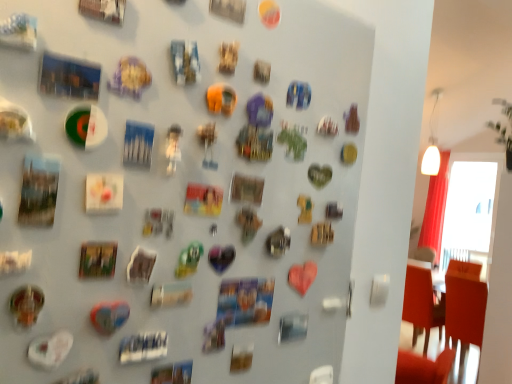
Identify the location of wooden framed picture at center-left, the third art positioned from the top. The width and height of the screenshot is (512, 384). pyautogui.click(x=97, y=259).

Locate an element on the screen. metallic gold coin at lower left, which appears as the second art when ordered from the bottom is located at coordinates (26, 305).

Where is `metallic silver magnet at center-left, which appears as the fourth art when viewed from the top`? The height and width of the screenshot is (384, 512). metallic silver magnet at center-left, which appears as the fourth art when viewed from the top is located at coordinates (141, 265).

Describe the element at coordinates (185, 61) in the screenshot. This screenshot has height=384, width=512. I see `blue paper at center, the sixth art from the bottom` at that location.

The height and width of the screenshot is (384, 512). Find the location of `wooden framed picture at center-left, which is counted as the fourth art, starting from the bottom`. wooden framed picture at center-left, which is counted as the fourth art, starting from the bottom is located at coordinates (97, 259).

From the picture: Would you consider wooden framed picture at center-left, the third art positioned from the top, to be distant from metallic gold coin at lower left, the 5th art in the top-to-bottom sequence?

They are positioned close to each other.

Does point (102, 271) lie in front of point (33, 297)?

No.

Could metallic gold coin at lower left, the 5th art in the top-to-bottom sequence, be considered to be inside wooden framed picture at center-left, which is counted as the fourth art, starting from the bottom?

No, metallic gold coin at lower left, the 5th art in the top-to-bottom sequence, is not inside wooden framed picture at center-left, which is counted as the fourth art, starting from the bottom.

Based on the photo, considering their positions, is wooden framed picture at center-left, which is counted as the fourth art, starting from the bottom, located in front of or behind metallic gold coin at lower left, the 5th art in the top-to-bottom sequence?

Clearly, wooden framed picture at center-left, which is counted as the fourth art, starting from the bottom, is behind metallic gold coin at lower left, the 5th art in the top-to-bottom sequence.

Is orange fabric chair at right to the right of metallic gold coin at lower left, the 5th art in the top-to-bottom sequence, from the viewer's perspective?

Yes.

Is orange fabric chair at right turned away from metallic gold coin at lower left, which appears as the second art when ordered from the bottom?

No, orange fabric chair at right is not facing away from metallic gold coin at lower left, which appears as the second art when ordered from the bottom.

Considering the relative sizes of orange fabric chair at right and metallic gold coin at lower left, the 5th art in the top-to-bottom sequence, in the image provided, is orange fabric chair at right wider than metallic gold coin at lower left, the 5th art in the top-to-bottom sequence,?

Indeed, orange fabric chair at right has a greater width compared to metallic gold coin at lower left, the 5th art in the top-to-bottom sequence.

This screenshot has height=384, width=512. What are the coordinates of `the 6th art in front of the orange fabric chair at right` in the screenshot? It's located at (26, 305).

Between metallic silver magnet at center-left, the 3th art positioned from the bottom, and metallic fridge magnets at center, which one appears on the right side from the viewer's perspective?

metallic fridge magnets at center is more to the right.

Which object is more forward, metallic silver magnet at center-left, the 3th art positioned from the bottom, or metallic fridge magnets at center?

metallic fridge magnets at center is closer to the camera.

Considering the sizes of metallic silver magnet at center-left, the 3th art positioned from the bottom, and metallic fridge magnets at center in the image, is metallic silver magnet at center-left, the 3th art positioned from the bottom, bigger or smaller than metallic fridge magnets at center?

In the image, metallic silver magnet at center-left, the 3th art positioned from the bottom, appears to be smaller than metallic fridge magnets at center.

Is metallic fridge magnets at center inside metallic silver magnet at center-left, the 3th art positioned from the bottom?

No, metallic fridge magnets at center is not inside metallic silver magnet at center-left, the 3th art positioned from the bottom.

From the image's perspective, between shiny metallic heart at center, which appears as the first art when ordered from the bottom, and orange fabric chair at right, which one is located above?

shiny metallic heart at center, which appears as the first art when ordered from the bottom, from the image's perspective.

Between point (124, 322) and point (408, 267), which one is positioned behind?

Positioned behind is point (408, 267).

This screenshot has height=384, width=512. Identify the location of chair directly beneath the shiny metallic heart at center, which appears as the first art when ordered from the bottom (from a real-world perspective). (430, 329).

Which is in front, shiny metallic heart at center, which appears as the first art when ordered from the bottom, or orange fabric chair at right?

shiny metallic heart at center, which appears as the first art when ordered from the bottom, is closer to the camera.

In terms of height, does orange fabric chair at right look taller or shorter compared to metallic fridge magnets at center?

In the image, orange fabric chair at right appears to be taller than metallic fridge magnets at center.

The width and height of the screenshot is (512, 384). Identify the location of chair that appears behind the metallic fridge magnets at center. (430, 329).

Could you tell me if orange fabric chair at right is turned towards metallic fridge magnets at center?

No.

Does point (408, 278) come closer to viewer compared to point (214, 124)?

No.

Image resolution: width=512 pixels, height=384 pixels. Find the location of `the 3rd art counting from the left of the metallic silver magnet at center-left, which appears as the fourth art when viewed from the top`. the 3rd art counting from the left of the metallic silver magnet at center-left, which appears as the fourth art when viewed from the top is located at coordinates (97, 259).

What's the angular difference between metallic silver magnet at center-left, which appears as the fourth art when viewed from the top, and wooden framed picture at center-left, the third art positioned from the top,'s facing directions?

The facing directions of metallic silver magnet at center-left, which appears as the fourth art when viewed from the top, and wooden framed picture at center-left, the third art positioned from the top, are 0.0104 degrees apart.

Between metallic silver magnet at center-left, the 3th art positioned from the bottom, and wooden framed picture at center-left, which is counted as the fourth art, starting from the bottom, which one has larger size?

Bigger between the two is metallic silver magnet at center-left, the 3th art positioned from the bottom.

Does metallic gold coin at lower left, which appears as the second art when ordered from the bottom, have a lesser height compared to metallic silver magnet at center-left, which appears as the fourth art when viewed from the top?

In fact, metallic gold coin at lower left, which appears as the second art when ordered from the bottom, may be taller than metallic silver magnet at center-left, which appears as the fourth art when viewed from the top.

What's the angular difference between metallic gold coin at lower left, which appears as the second art when ordered from the bottom, and metallic silver magnet at center-left, which appears as the fourth art when viewed from the top,'s facing directions?

The angle between the facing direction of metallic gold coin at lower left, which appears as the second art when ordered from the bottom, and the facing direction of metallic silver magnet at center-left, which appears as the fourth art when viewed from the top, is 0.00608 degrees.

From the picture: Between metallic gold coin at lower left, which appears as the second art when ordered from the bottom, and metallic silver magnet at center-left, the 3th art positioned from the bottom, which one has smaller size?

With smaller size is metallic silver magnet at center-left, the 3th art positioned from the bottom.

Is metallic gold coin at lower left, the 5th art in the top-to-bottom sequence, in contact with metallic silver magnet at center-left, the 3th art positioned from the bottom?

metallic gold coin at lower left, the 5th art in the top-to-bottom sequence, is not next to metallic silver magnet at center-left, the 3th art positioned from the bottom, and they're not touching.

Which art is the 1st one when counting from the back of the metallic gold coin at lower left, the 5th art in the top-to-bottom sequence? Please provide its 2D coordinates.

[(97, 259)]

What are the coordinates of `chair located on the right of metallic gold coin at lower left, the 5th art in the top-to-bottom sequence` in the screenshot? It's located at (430, 329).

Looking at this image, estimate the real-world distances between objects in this image. Which object is further from gold textured coin at upper center, the 2th art positioned from the top, metallic gold coin at lower left, the 5th art in the top-to-bottom sequence, or wooden framed picture at center-left, the third art positioned from the top?

metallic gold coin at lower left, the 5th art in the top-to-bottom sequence, is positioned further to the anchor gold textured coin at upper center, the 2th art positioned from the top.

Considering their positions, is metallic gold coin at lower left, the 5th art in the top-to-bottom sequence, positioned closer to white glass window screen at upper right than shiny metallic heart at center, which appears as the first art when ordered from the bottom?

shiny metallic heart at center, which appears as the first art when ordered from the bottom, lies closer to white glass window screen at upper right than the other object.

When comparing their distances from wooden framed picture at center-left, the third art positioned from the top, does gold textured coin at upper center, the 2th art positioned from the top, or metallic gold coin at lower left, the 5th art in the top-to-bottom sequence, seem closer?

metallic gold coin at lower left, the 5th art in the top-to-bottom sequence.

Based on their spatial positions, is shiny metallic heart at center, acting as the 6th art starting from the top, or metallic silver magnet at center-left, which appears as the fourth art when viewed from the top, further from metallic fridge magnets at center?

shiny metallic heart at center, acting as the 6th art starting from the top, lies further to metallic fridge magnets at center than the other object.

When comparing their distances from shiny metallic heart at center, acting as the 6th art starting from the top, does metallic fridge magnets at center or white glass window screen at upper right seem further?

white glass window screen at upper right is positioned further to the anchor shiny metallic heart at center, acting as the 6th art starting from the top.

Estimate the real-world distances between objects in this image. Which object is closer to metallic fridge magnets at center, white glass window screen at upper right or metallic gold coin at lower left, which appears as the second art when ordered from the bottom?

Among the two, metallic gold coin at lower left, which appears as the second art when ordered from the bottom, is located nearer to metallic fridge magnets at center.

Based on their spatial positions, is wooden framed picture at center-left, which is counted as the fourth art, starting from the bottom, or gold textured coin at upper center, which ranks as the 5th art in bottom-to-top order, further from metallic fridge magnets at center?

gold textured coin at upper center, which ranks as the 5th art in bottom-to-top order, lies further to metallic fridge magnets at center than the other object.

When comparing their distances from orange fabric chair at right, does shiny metallic heart at center, acting as the 6th art starting from the top, or metallic gold coin at lower left, the 5th art in the top-to-bottom sequence, seem closer?

The object closer to orange fabric chair at right is shiny metallic heart at center, acting as the 6th art starting from the top.

The image size is (512, 384). What are the coordinates of `collection between gold textured coin at upper center, which ranks as the 5th art in bottom-to-top order, and metallic silver magnet at center-left, the 3th art positioned from the bottom, in the vertical direction` in the screenshot? It's located at (181, 191).

Locate an element on the screen. art between gold textured coin at upper center, the 2th art positioned from the top, and metallic silver magnet at center-left, which appears as the fourth art when viewed from the top, in the vertical direction is located at coordinates (97, 259).

I want to click on chair positioned between blue paper at center, which is the 1th art from top to bottom, and white glass window screen at upper right from near to far, so click(x=430, y=329).

Locate an element on the screen. collection between blue paper at center, the sixth art from the bottom, and metallic silver magnet at center-left, the 3th art positioned from the bottom, vertically is located at coordinates (181, 191).